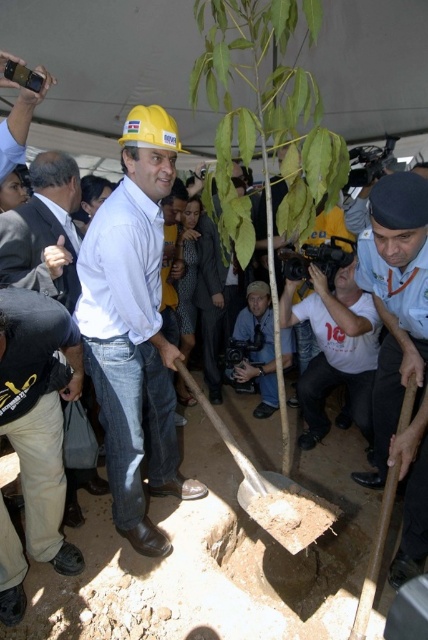
Is point (35, 253) positioned after point (255, 470)?

No, it is in front of (255, 470).

What do you see at coordinates (44, 230) in the screenshot? The height and width of the screenshot is (640, 428). I see `dark gray suit at center` at bounding box center [44, 230].

The image size is (428, 640). What are the coordinates of `dark gray suit at center` in the screenshot? It's located at (44, 230).

Does point (53, 266) lie in front of point (258, 282)?

Yes, it is.

Which is below, dark gray suit at center or matte black camera at lower center?

matte black camera at lower center is lower down.

Is point (44, 272) positioned before point (264, 362)?

Yes.

Where is `dark gray suit at center`? dark gray suit at center is located at coordinates (44, 230).

Is wooden shovel at center below brown wooden shovel at center?

Actually, wooden shovel at center is above brown wooden shovel at center.

Can you confirm if wooden shovel at center is shorter than brown wooden shovel at center?

Yes, wooden shovel at center is shorter than brown wooden shovel at center.

Measure the distance between point (327, 513) and camera.

They are 2.58 meters apart.

The image size is (428, 640). Identify the location of wooden shovel at center. (270, 490).